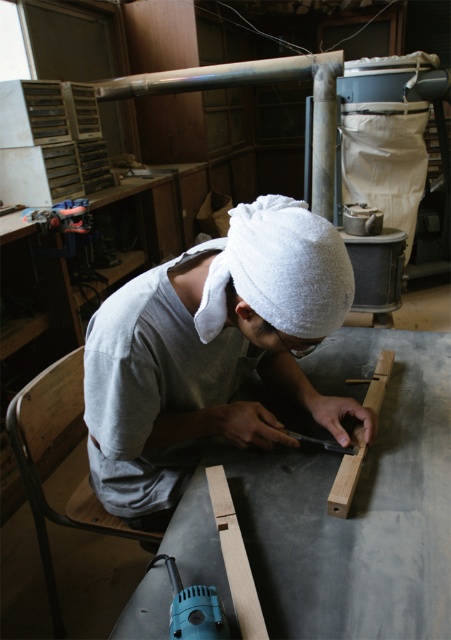
Question: Which point is farther from the camera taking this photo?

Choices:
 (A) (340, 470)
 (B) (188, 72)
 (C) (220, 637)
 (D) (317, 404)

Answer: (B)

Question: Which point is farther to the camera?

Choices:
 (A) (303, 65)
 (B) (280, 324)

Answer: (A)

Question: Which point is closer to the camera?

Choices:
 (A) gray cotton towel at center
 (B) smooth bamboo at upper center
 (C) light brown wood plank at lower center

Answer: (C)

Question: Does gray cotton towel at center come behind white towel at center?

Choices:
 (A) yes
 (B) no

Answer: (A)

Question: Does light brown wood plank at lower center appear over blue plastic drill at lower left?

Choices:
 (A) yes
 (B) no

Answer: (A)

Question: Can you confirm if blue plastic drill at lower left is positioned above light wood plank at center?

Choices:
 (A) yes
 (B) no

Answer: (B)